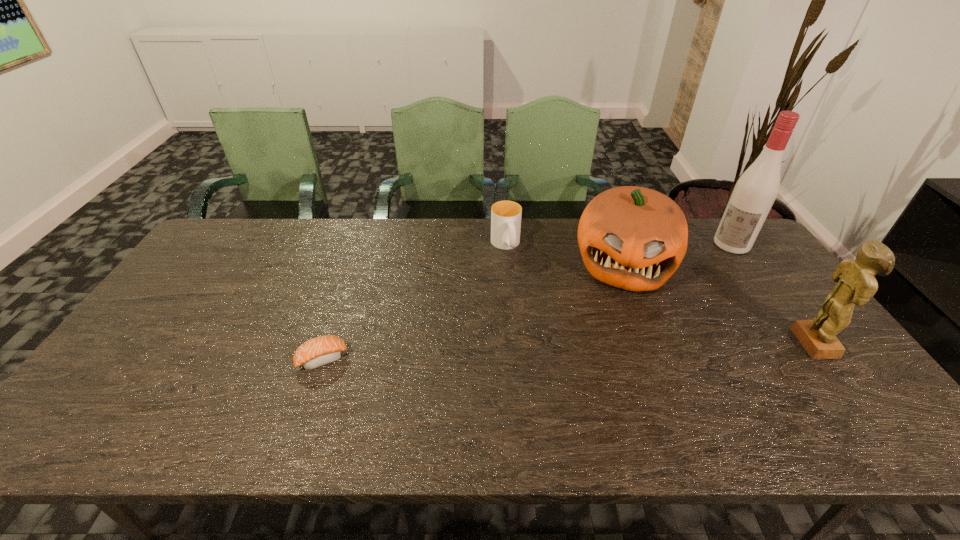
Locate an element on the screen. the leftmost object is located at coordinates (322, 350).

This screenshot has width=960, height=540. In order to click on the shortest object in this screenshot , I will do `click(322, 350)`.

Where is `figurine`? This screenshot has width=960, height=540. figurine is located at coordinates (856, 283).

What are the coordinates of `the third tallest object` in the screenshot? It's located at (634, 238).

The width and height of the screenshot is (960, 540). I want to click on the third object from left to right, so click(x=634, y=238).

Where is `the tallest object`? The height and width of the screenshot is (540, 960). the tallest object is located at coordinates (757, 188).

This screenshot has height=540, width=960. I want to click on cup, so coord(505,215).

At what (x,y) coordinates should I click in order to perform the action: click on the second shortest object. Please return your answer as a coordinate pair (x, y). Image resolution: width=960 pixels, height=540 pixels. Looking at the image, I should click on (505, 215).

Locate an element on the screen. The width and height of the screenshot is (960, 540). vacant space positioned on the left of the shortest object is located at coordinates (x=262, y=359).

The height and width of the screenshot is (540, 960). I want to click on vacant space located on the face of the pumpkin, so click(618, 318).